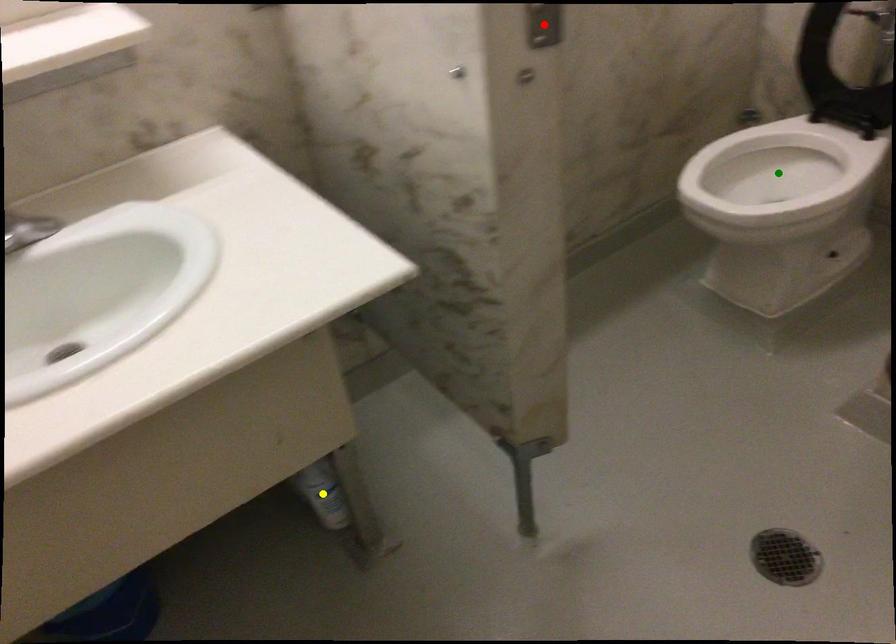
Order these from nearest to farthest:
red point
green point
yellow point

red point, yellow point, green point